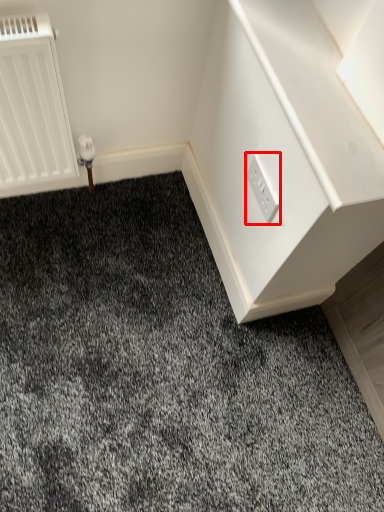
Question: From the image's perspective, what is the correct spatial relationship of power plugs and sockets (annotated by the red box) in relation to dresser?

Choices:
 (A) above
 (B) below

Answer: (B)